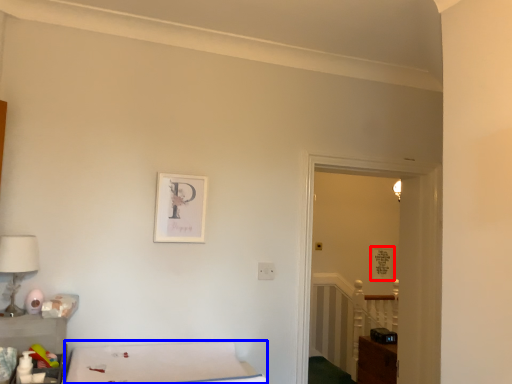
Question: Which point is closer to the camera, picture frame (highlighted by a red box) or furniture (highlighted by a blue box)?

Choices:
 (A) picture frame
 (B) furniture

Answer: (B)